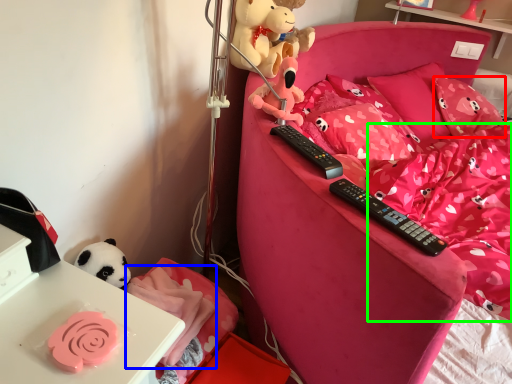
Question: Estimate the real-world distances between objects in this image. Which object is closer to pillow (highlighted by a red box), blanket (highlighted by a blue box) or bedding (highlighted by a green box)?

Choices:
 (A) blanket
 (B) bedding

Answer: (B)